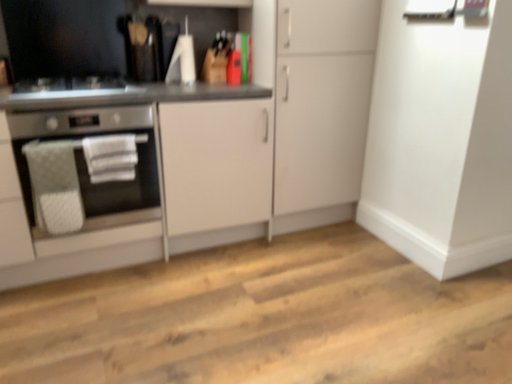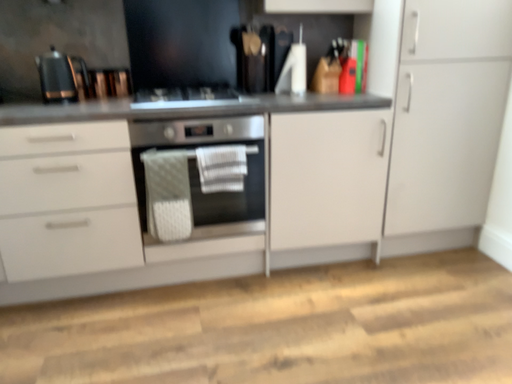
Question: Which way did the camera rotate in the video?

Choices:
 (A) rotated right
 (B) rotated left

Answer: (B)